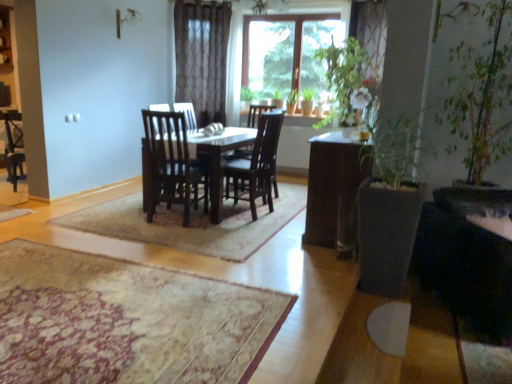
The width and height of the screenshot is (512, 384). I want to click on metallic silver lamp at upper center, so click(126, 19).

Find the location of a particular element. The image size is (512, 384). beige textured rug at center is located at coordinates (126, 321).

Visually, is metallic silver lamp at upper center positioned to the left or to the right of beige textured rug at center?

metallic silver lamp at upper center is to the left of beige textured rug at center.

Is metallic silver lamp at upper center aimed at beige textured rug at center?

No.

From their relative heights in the image, would you say metallic silver lamp at upper center is taller or shorter than beige textured rug at center?

Considering their sizes, metallic silver lamp at upper center has more height than beige textured rug at center.

Measure the distance between metallic silver lamp at upper center and beige textured rug at center.

The distance of metallic silver lamp at upper center from beige textured rug at center is 3.79 meters.

At what (x,y) coordinates should I click in order to perform the action: click on lamp located behind the beige textured rug at center. Please return your answer as a coordinate pair (x, y). Looking at the image, I should click on (126, 19).

Based on the photo, is beige textured rug at center wider than metallic silver lamp at upper center?

Yes.

Is point (149, 381) farther from camera compared to point (118, 14)?

No, (149, 381) is closer to viewer.

From a real-world perspective, is metallic silver lamp at upper center physically above matte white cabinet at upper left?

Yes, from a real-world perspective, metallic silver lamp at upper center is on top of matte white cabinet at upper left.

Is metallic silver lamp at upper center positioned behind matte white cabinet at upper left?

No, it is not.

Identify the location of lamp above the matte white cabinet at upper left (from a real-world perspective). This screenshot has height=384, width=512. (126, 19).

Who is smaller, metallic silver lamp at upper center or matte white cabinet at upper left?

metallic silver lamp at upper center is smaller.

Can you tell me how much matte white cabinet at upper left and metallic silver lamp at upper center differ in facing direction?

The angle between the facing direction of matte white cabinet at upper left and the facing direction of metallic silver lamp at upper center is 108 degrees.

Is matte white cabinet at upper left with metallic silver lamp at upper center?

matte white cabinet at upper left and metallic silver lamp at upper center are not in contact.

Which is in front, matte white cabinet at upper left or metallic silver lamp at upper center?

metallic silver lamp at upper center is in front.

Does matte white cabinet at upper left have a lesser width compared to metallic silver lamp at upper center?

No.

Is beige textured rug at center positioned beyond the bounds of matte white cabinet at upper left?

Yes, beige textured rug at center is not within matte white cabinet at upper left.

From a real-world perspective, relative to matte white cabinet at upper left, is beige textured rug at center vertically above or below?

beige textured rug at center is below matte white cabinet at upper left.

From the image's perspective, which is below, beige textured rug at center or matte white cabinet at upper left?

beige textured rug at center is shown below in the image.

Between matte white cabinet at upper left and beige textured rug at center, which one is positioned in front?

beige textured rug at center is more forward.

From a real-world perspective, relative to beige textured rug at center, is matte white cabinet at upper left vertically above or below?

In terms of real-world spatial position, matte white cabinet at upper left is above beige textured rug at center.

How many degrees apart are the facing directions of matte white cabinet at upper left and beige textured rug at center?

matte white cabinet at upper left and beige textured rug at center are facing 176 degrees away from each other.

Considering the relative sizes of matte white cabinet at upper left and beige textured rug at center in the image provided, is matte white cabinet at upper left wider than beige textured rug at center?

No.

Locate an element on the screen. lamp located above the beige textured rug at center (from a real-world perspective) is located at coordinates (126, 19).

What are the coordinates of `lamp on the left side of beige textured rug at center` in the screenshot? It's located at (126, 19).

Considering their positions, is matte white cabinet at upper left positioned closer to beige textured rug at center than metallic silver lamp at upper center?

Based on the image, matte white cabinet at upper left appears to be nearer to beige textured rug at center.

Estimate the real-world distances between objects in this image. Which object is closer to beige textured rug at center, metallic silver lamp at upper center or matte white cabinet at upper left?

Among the two, matte white cabinet at upper left is located nearer to beige textured rug at center.

Based on their spatial positions, is beige textured rug at center or matte white cabinet at upper left further from metallic silver lamp at upper center?

The object further to metallic silver lamp at upper center is beige textured rug at center.

Based on their spatial positions, is metallic silver lamp at upper center or beige textured rug at center further from matte white cabinet at upper left?

beige textured rug at center is positioned further to the anchor matte white cabinet at upper left.

From the image, which object appears to be farther from matte white cabinet at upper left, beige textured rug at center or metallic silver lamp at upper center?

The object further to matte white cabinet at upper left is beige textured rug at center.

Estimate the real-world distances between objects in this image. Which object is further from metallic silver lamp at upper center, matte white cabinet at upper left or beige textured rug at center?

beige textured rug at center.

Where is `lamp located between beige textured rug at center and matte white cabinet at upper left in the depth direction`? lamp located between beige textured rug at center and matte white cabinet at upper left in the depth direction is located at coordinates (126, 19).